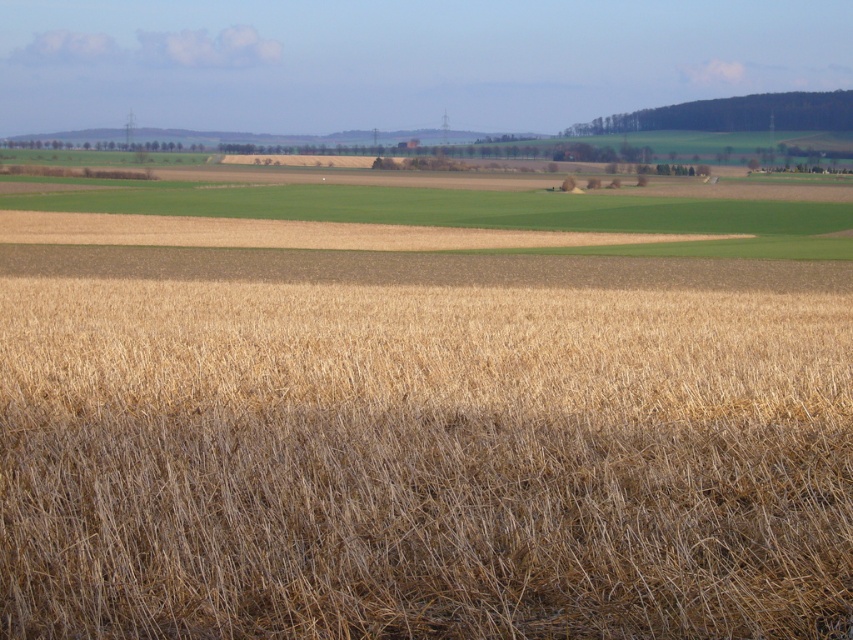
In the scene shown: Who is more forward, (607, 396) or (738, 224)?

Point (607, 396) is in front.

Which is below, dry straw field at center or brown grassland at center?

Positioned lower is dry straw field at center.

Measure the distance between dry straw field at center and camera.

A distance of 14.41 feet exists between dry straw field at center and camera.

This screenshot has height=640, width=853. I want to click on dry straw field at center, so click(x=421, y=461).